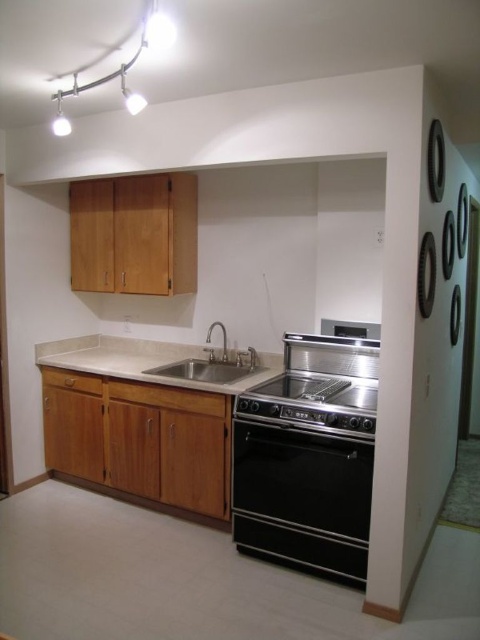
Based on the photo, you are a kitchen designer planning to install a new appliance. You have a black stainless steel oven at center and a silver metallic faucet at center in the kitchen. Which appliance is located lower in the kitchen?

The black stainless steel oven at center is located below the silver metallic faucet at center, so it is lower in the kitchen.

What is located at the point with coordinates (301, 497) in the image?

The point at coordinates (301, 497) indicates the location of the black stainless steel oven at center.